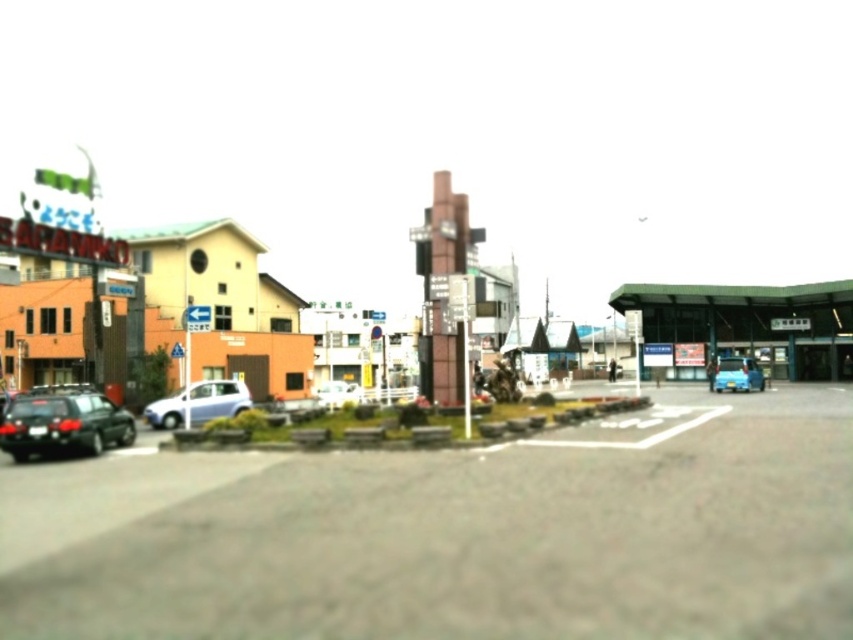
Question: Does black matte car at lower left have a lesser width compared to blue glossy car at lower right?

Choices:
 (A) yes
 (B) no

Answer: (B)

Question: Which point appears farthest from the camera in this image?

Choices:
 (A) (206, 419)
 (B) (216, 225)
 (C) (561, 500)

Answer: (B)

Question: Does matte orange building at left appear on the right side of silver metallic van at lower left?

Choices:
 (A) no
 (B) yes

Answer: (B)

Question: Is smooth asphalt parking lot at center thinner than blue glossy car at lower right?

Choices:
 (A) yes
 (B) no

Answer: (B)

Question: Which of these objects is positioned closest to the smooth asphalt parking lot at center?

Choices:
 (A) blue glossy car at lower right
 (B) silver metallic van at lower left
 (C) matte orange building at left

Answer: (B)

Question: Considering the real-world distances, which object is closest to the matte orange building at left?

Choices:
 (A) smooth asphalt parking lot at center
 (B) blue glossy car at lower right

Answer: (A)